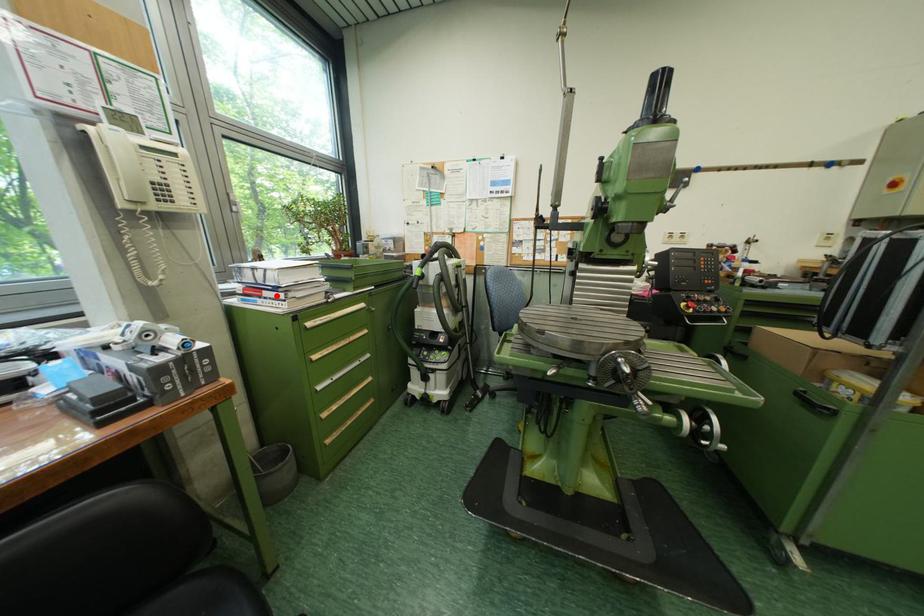
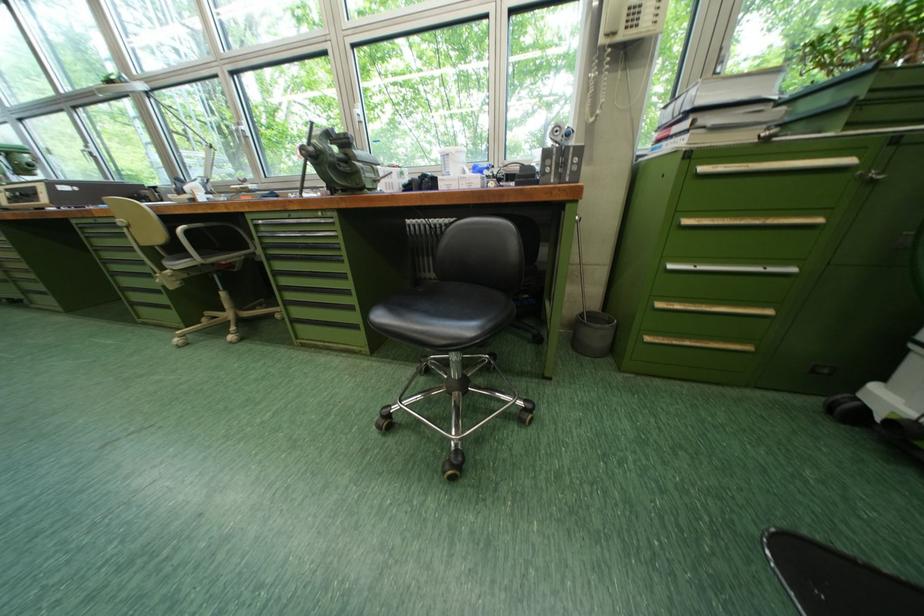
The point at the highlighted location is marked in the first image. Where is the corresponding point in the second image?

(686, 132)